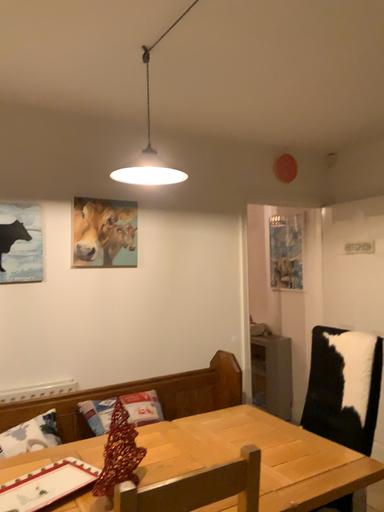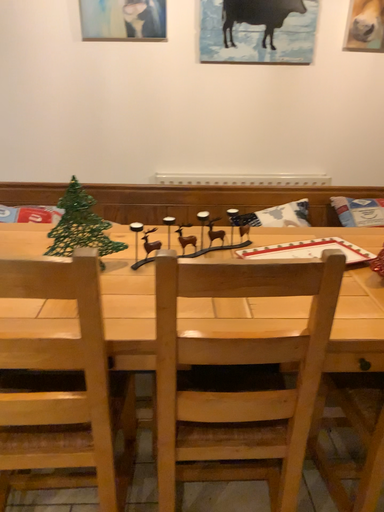
Question: Which way did the camera rotate in the video?

Choices:
 (A) rotated downward
 (B) rotated upward

Answer: (A)